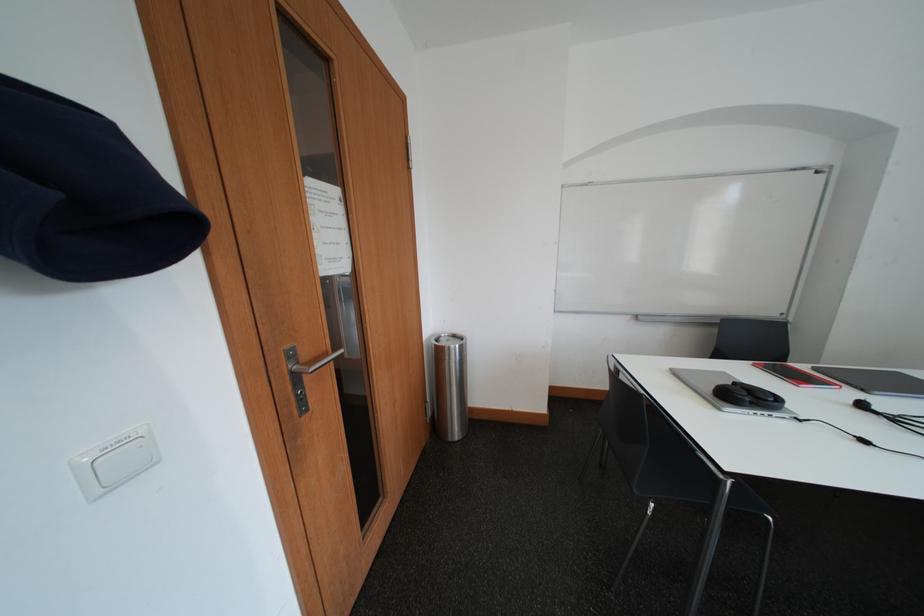
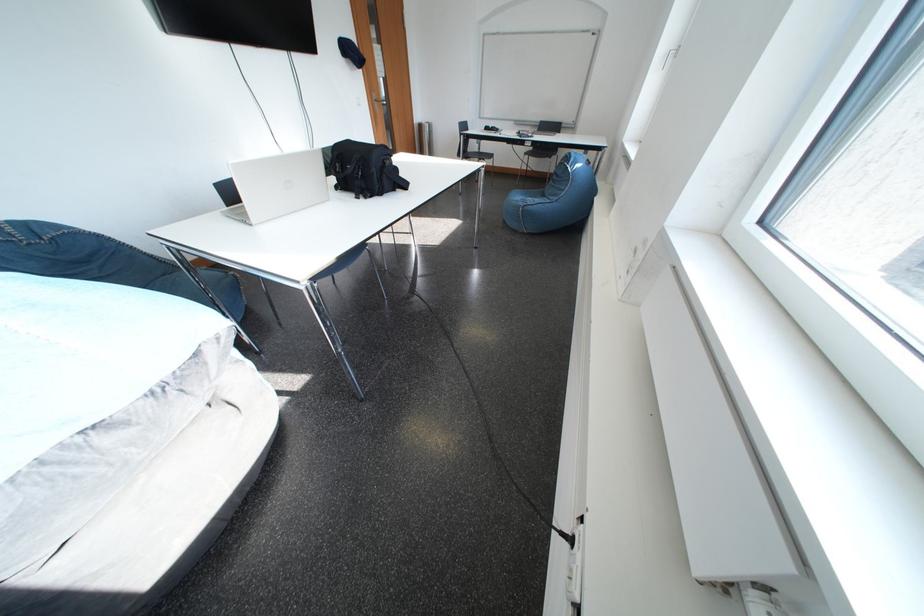
What movement of the cameraman would produce the second image?

The movement direction of the cameraman is right, backward.